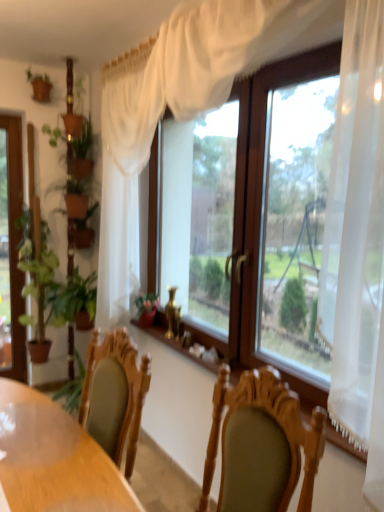
Question: From the image's perspective, is green leafy plant at left located above wooden table at center?

Choices:
 (A) no
 (B) yes

Answer: (B)

Question: Would you say green leafy plant at left is outside wooden table at center?

Choices:
 (A) yes
 (B) no

Answer: (A)

Question: Is green leafy plant at left aimed at wooden table at center?

Choices:
 (A) yes
 (B) no

Answer: (B)

Question: Is green leafy plant at left positioned in front of wooden table at center?

Choices:
 (A) yes
 (B) no

Answer: (B)

Question: Is the depth of green leafy plant at left greater than that of wooden table at center?

Choices:
 (A) no
 (B) yes

Answer: (B)

Question: From a real-world perspective, is wooden table at center above or below transparent glass window at center?

Choices:
 (A) below
 (B) above

Answer: (A)

Question: Choose the correct answer: Is wooden table at center inside transparent glass window at center or outside it?

Choices:
 (A) outside
 (B) inside

Answer: (A)

Question: In the image, is wooden table at center positioned in front of or behind transparent glass window at center?

Choices:
 (A) behind
 (B) front

Answer: (A)

Question: From the image's perspective, is wooden table at center above or below transparent glass window at center?

Choices:
 (A) above
 (B) below

Answer: (B)

Question: Choose the correct answer: Is wooden table at center inside green leafy plant at left or outside it?

Choices:
 (A) outside
 (B) inside

Answer: (A)

Question: Relative to green leafy plant at left, is wooden table at center in front or behind?

Choices:
 (A) behind
 (B) front

Answer: (B)

Question: Is point (49, 501) closer or farther from the camera than point (23, 313)?

Choices:
 (A) farther
 (B) closer

Answer: (B)

Question: From a real-world perspective, is wooden table at center physically located above or below green leafy plant at left?

Choices:
 (A) below
 (B) above

Answer: (A)

Question: Is transparent glass window at center situated inside wooden table at center or outside?

Choices:
 (A) inside
 (B) outside

Answer: (B)

Question: From the image's perspective, is transparent glass window at center located above or below wooden table at center?

Choices:
 (A) below
 (B) above

Answer: (B)